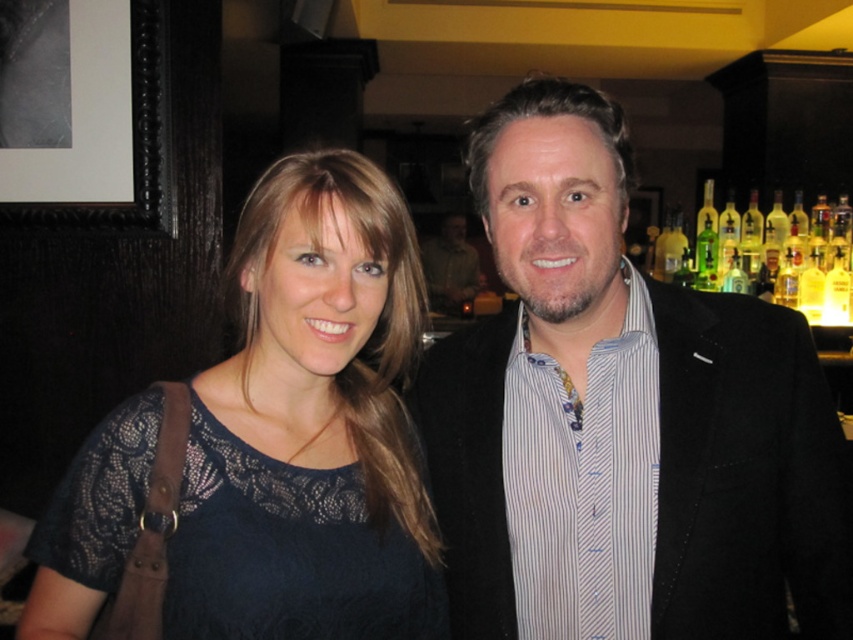
You are standing in the room where the two people are. You want to hang a new picture frame exactly where the black wooden picture frame at upper left is currently located. What are the coordinates of the spot where you should place the new frame?

The coordinates for the black wooden picture frame at upper left are at point (132, 145), so you should place the new frame at those coordinates.

You are at a party and want to hang a new photo on the wall between the black wooden picture frame at upper left and the matte black suit at center. Is there enough space to place it there?

The black wooden picture frame at upper left is to the left of the matte black suit at center, so there is space between them to place the new photo.